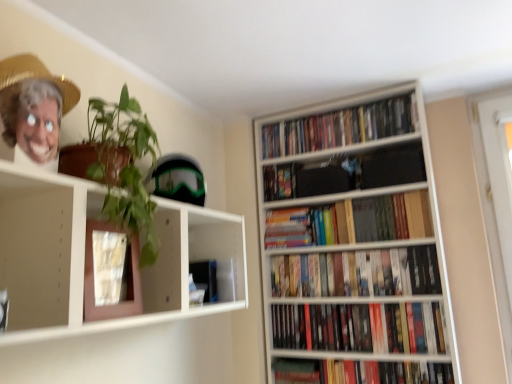
Question: From a real-world perspective, does hardcover book at lower right, the first book in the bottom-to-top sequence, sit lower than hardcover books at center, the 5th book viewed from the top?

Choices:
 (A) yes
 (B) no

Answer: (A)

Question: Is hardcover book at lower right, acting as the 7th book starting from the top, taller than hardcover books at center, the 3th book when ordered from bottom to top?

Choices:
 (A) yes
 (B) no

Answer: (B)

Question: Is hardcover book at lower right, acting as the 7th book starting from the top, not near hardcover books at center, the 3th book when ordered from bottom to top?

Choices:
 (A) yes
 (B) no

Answer: (B)

Question: Does hardcover book at lower right, the first book in the bottom-to-top sequence, come behind hardcover books at center, the 5th book viewed from the top?

Choices:
 (A) yes
 (B) no

Answer: (B)

Question: Could hardcover books at center, the 3th book when ordered from bottom to top, be considered to be inside hardcover book at lower right, acting as the 7th book starting from the top?

Choices:
 (A) yes
 (B) no

Answer: (B)

Question: Can you confirm if hardcover book at lower right, the first book in the bottom-to-top sequence, is thinner than hardcover books at center, the 3th book when ordered from bottom to top?

Choices:
 (A) no
 (B) yes

Answer: (A)

Question: Does hardcover books at center, the 2th book positioned from the bottom, have a greater width compared to multicolored plastic toy at upper center, the 6th book positioned from the bottom?

Choices:
 (A) yes
 (B) no

Answer: (A)

Question: Does hardcover books at center, the 2th book positioned from the bottom, lie behind multicolored plastic toy at upper center, the 6th book positioned from the bottom?

Choices:
 (A) no
 (B) yes

Answer: (A)

Question: Is hardcover books at center, arranged as the 6th book when viewed from the top, thinner than multicolored plastic toy at upper center, placed as the second book when sorted from top to bottom?

Choices:
 (A) yes
 (B) no

Answer: (B)

Question: Is hardcover books at center, arranged as the 6th book when viewed from the top, far from multicolored plastic toy at upper center, placed as the second book when sorted from top to bottom?

Choices:
 (A) no
 (B) yes

Answer: (A)

Question: Is hardcover books at center, the 2th book positioned from the bottom, positioned with its back to multicolored plastic toy at upper center, the 6th book positioned from the bottom?

Choices:
 (A) yes
 (B) no

Answer: (B)

Question: Does hardcover books at center, arranged as the 6th book when viewed from the top, turn towards multicolored plastic toy at upper center, the 6th book positioned from the bottom?

Choices:
 (A) yes
 (B) no

Answer: (B)

Question: Is wooden bookshelf at right at the left side of multicolored paperbacks at upper right, placed as the first book when sorted from top to bottom?

Choices:
 (A) yes
 (B) no

Answer: (B)